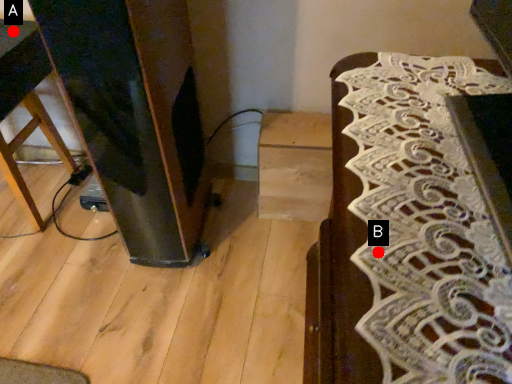
Question: Two points are circled on the image, labeled by A and B beside each circle. Which point appears farthest from the camera in this image?

Choices:
 (A) A is further
 (B) B is further

Answer: (A)